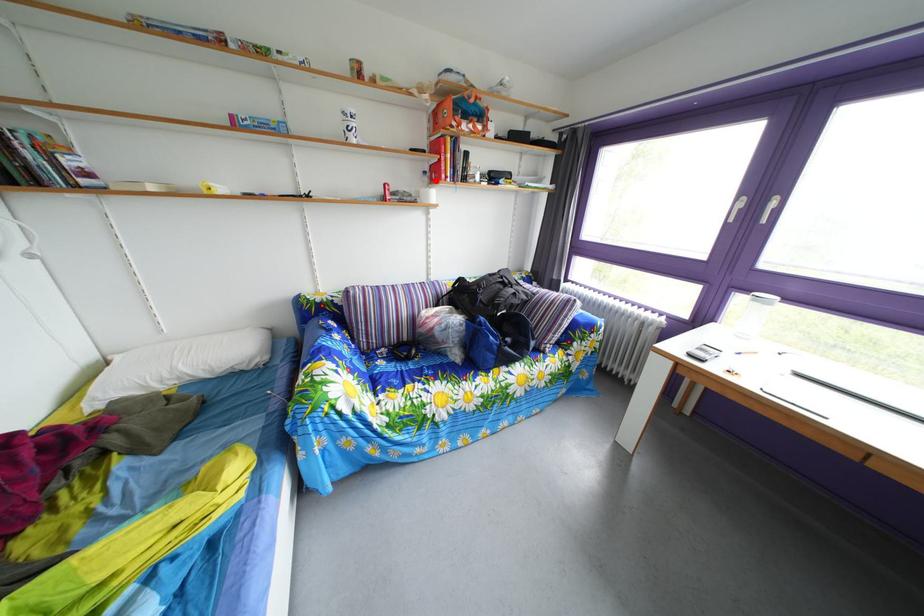
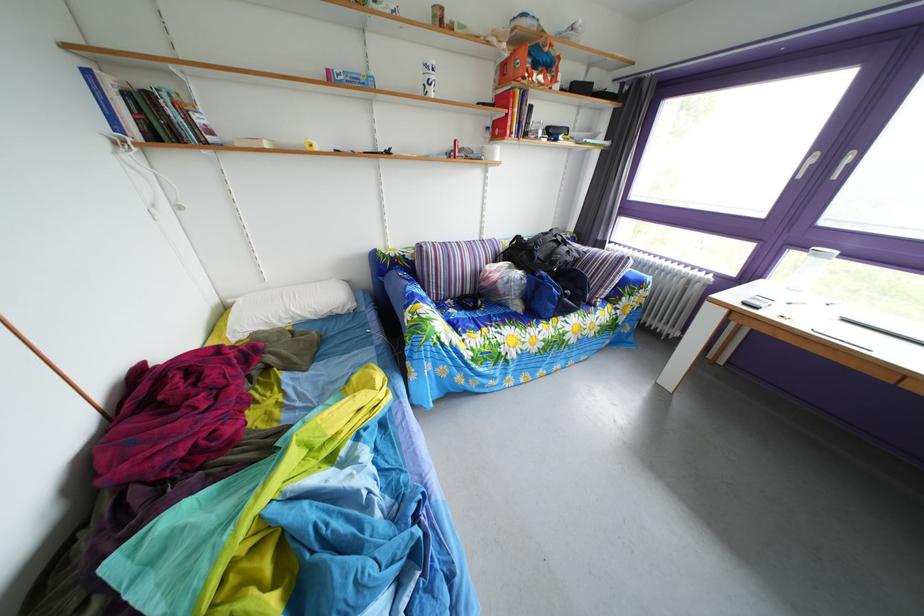
The point at the highlighted location is marked in the first image. Where is the corresponding point in the second image?

(499, 137)